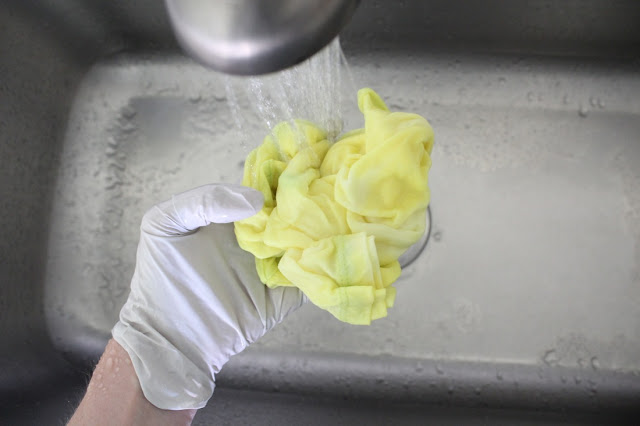
This screenshot has height=426, width=640. Find the location of `large stainless steel faucet head`. large stainless steel faucet head is located at coordinates (284, 39).